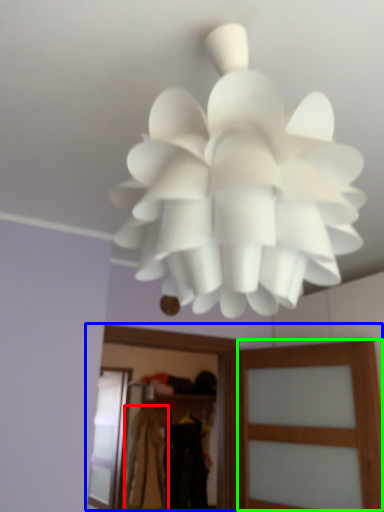
Question: Estimate the real-world distances between objects in this image. Which object is closer to clothing (highlighted by a red box), clothing (highlighted by a blue box) or screen door (highlighted by a green box)?

Choices:
 (A) clothing
 (B) screen door

Answer: (A)